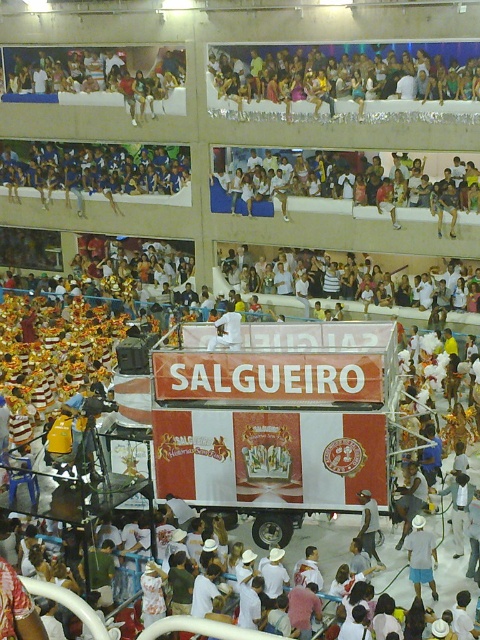
You are a photographer trying to capture both the white cotton shorts at center and the white plastic bag at center in the same frame. Which object should you focus on first to ensure both are in the frame?

The white cotton shorts at center is smaller than the white plastic bag at center, so you should focus on the white plastic bag at center first to ensure both objects are captured in the frame.

You are a photographer standing at the center of the carnival parade. You want to take a photo of the white cotton shorts at center. Where should you aim your camera to capture it?

You should aim your camera at the point with coordinates (420, 556) to capture the white cotton shorts at center.